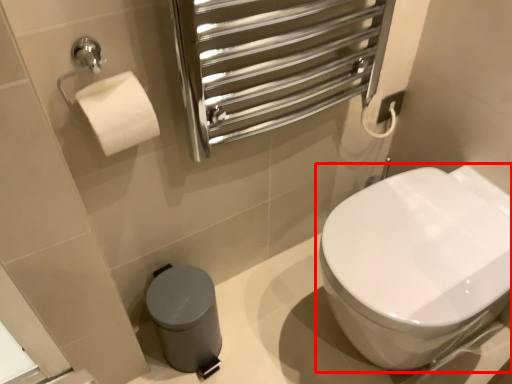
Question: From the image, what is the correct spatial relationship of toilet (annotated by the red box) in relation to porcelain?

Choices:
 (A) left
 (B) right

Answer: (B)